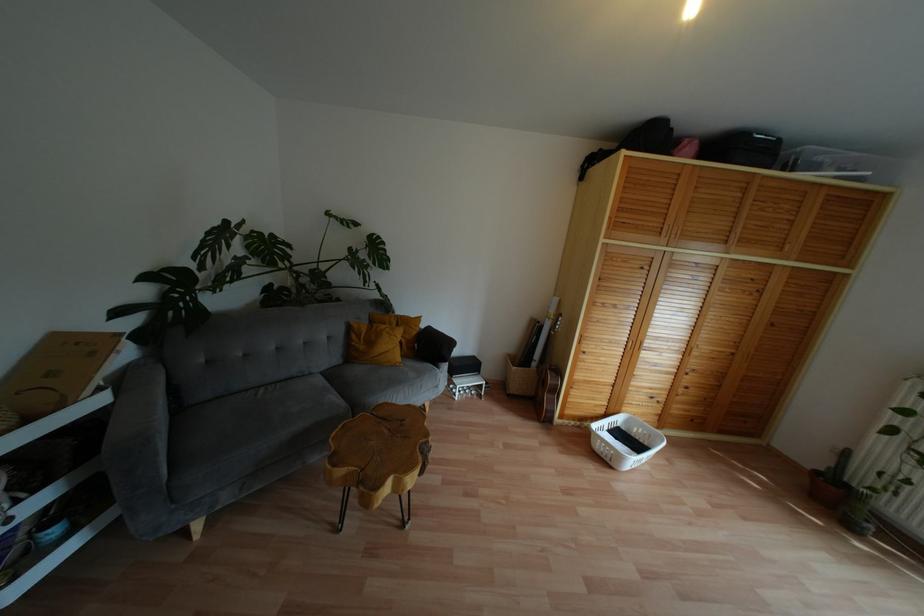
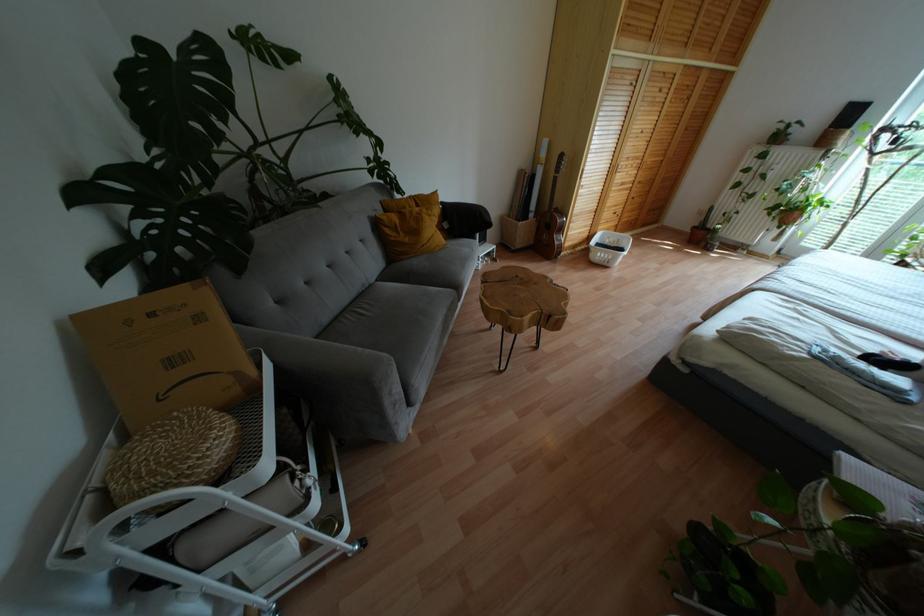
The point at (418, 318) is marked in the first image. Where is the corresponding point in the second image?

(434, 193)